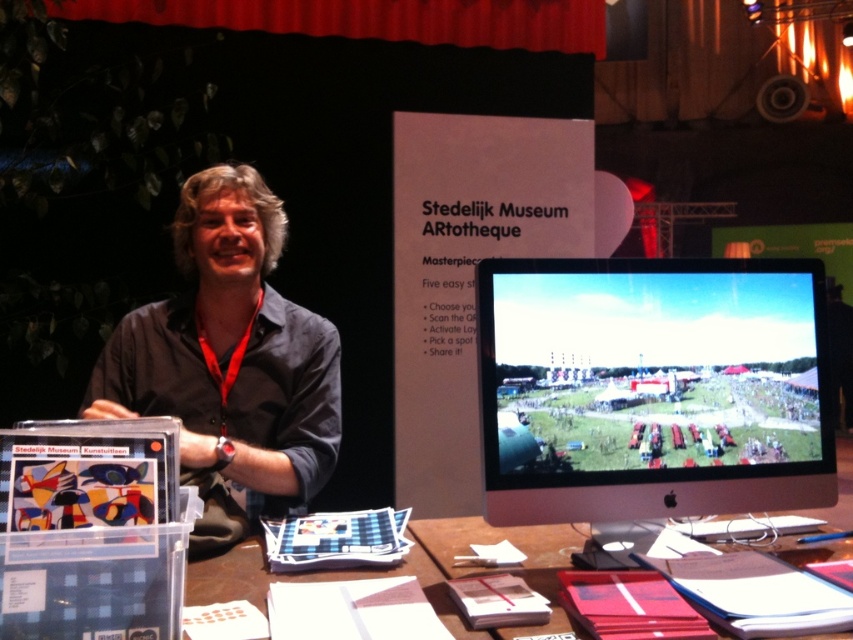
The image size is (853, 640). Describe the element at coordinates (229, 362) in the screenshot. I see `dark blue shirt at center` at that location.

Can you confirm if dark blue shirt at center is positioned to the right of brown paper at center?

No, dark blue shirt at center is not to the right of brown paper at center.

Find the location of a particular element. The height and width of the screenshot is (640, 853). dark blue shirt at center is located at coordinates (229, 362).

Locate an element on the screen. This screenshot has height=640, width=853. dark blue shirt at center is located at coordinates (229, 362).

Does satin black monitor at center lie behind dark blue shirt at center?

No, satin black monitor at center is closer to the viewer.

Is satin black monitor at center taller than dark blue shirt at center?

Incorrect, satin black monitor at center's height is not larger of dark blue shirt at center's.

Is point (820, 392) positioned after point (206, 212)?

That is False.

In order to click on satin black monitor at center in this screenshot , I will do pyautogui.click(x=653, y=387).

Who is more forward, (518,484) or (239,548)?

Point (518,484) is in front.

Between point (670, 262) and point (196, 593), which one is positioned behind?

Positioned behind is point (670, 262).

Is point (640, 412) farther from viewer compared to point (521, 529)?

No, it is in front of (521, 529).

What are the coordinates of `satin black monitor at center` in the screenshot? It's located at (653, 387).